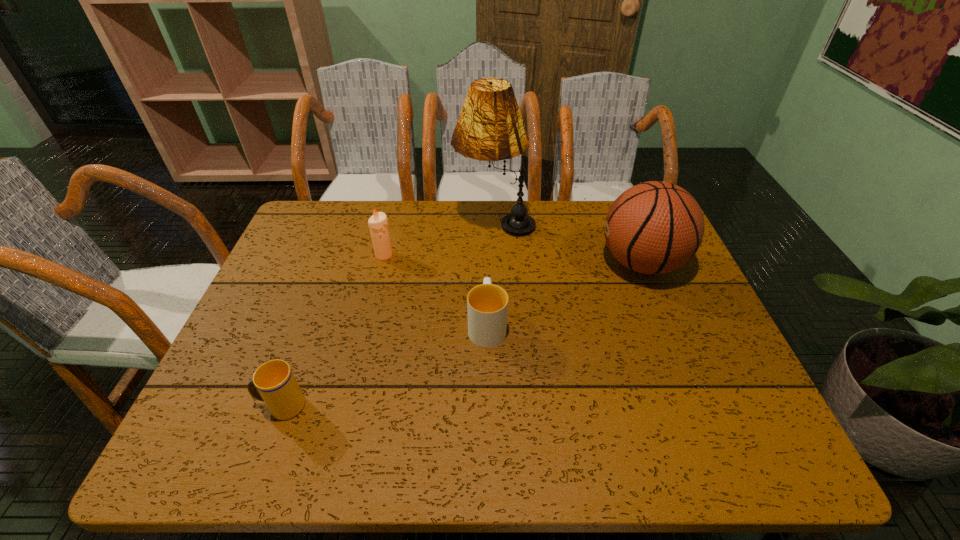
Where is `free space located 0.090m on the front-facing side of the lampshade`? free space located 0.090m on the front-facing side of the lampshade is located at coordinates (425, 222).

At what (x,y) coordinates should I click in order to perform the action: click on vacant space located 0.310m on the front-facing side of the lampshade. Please return your answer as a coordinate pair (x, y). Looking at the image, I should click on (353, 222).

At what (x,y) coordinates should I click in order to perform the action: click on vacant region located on the side where the inflation valve is located. Please return your answer as a coordinate pair (x, y). Looking at the image, I should click on pyautogui.click(x=475, y=264).

Image resolution: width=960 pixels, height=540 pixels. I want to click on vacant region located on the side where the inflation valve is located, so click(x=493, y=264).

This screenshot has width=960, height=540. In order to click on vacant area located on the side where the inflation valve is located in this screenshot , I will do `click(493, 264)`.

I want to click on blank space located 0.220m on the right of the candle, so click(471, 255).

Where is `vacant space located with the handle on the side of the farther cup`? Image resolution: width=960 pixels, height=540 pixels. vacant space located with the handle on the side of the farther cup is located at coordinates (486, 224).

Where is `vacant space located with the handle on the side of the farther cup`? The image size is (960, 540). vacant space located with the handle on the side of the farther cup is located at coordinates (486, 230).

I want to click on vacant space located with the handle on the side of the farther cup, so click(486, 269).

Where is `vacant position located on the side of the nearer cup with the handle`? vacant position located on the side of the nearer cup with the handle is located at coordinates (224, 406).